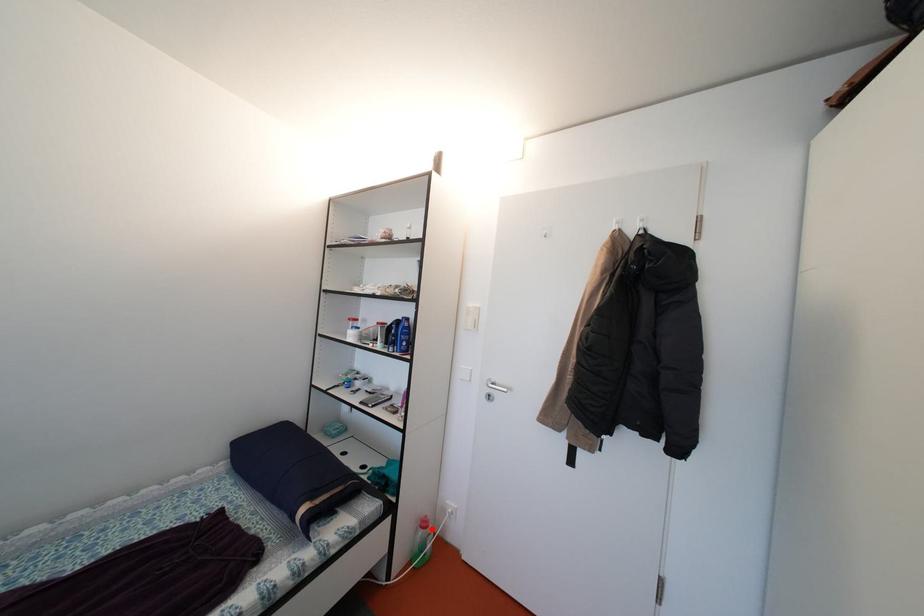
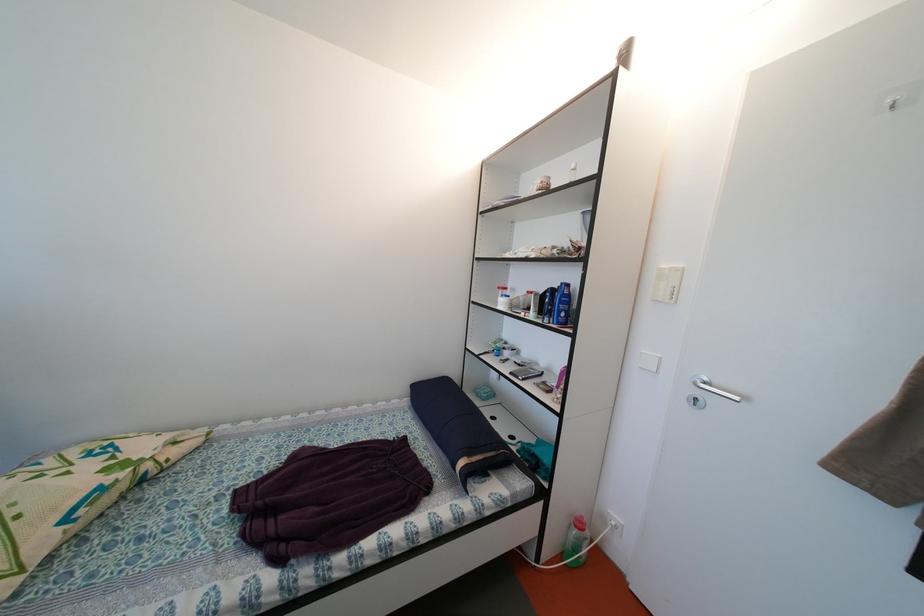
In the second image, find the point that corresponds to the highlighted location in the first image.

(587, 530)